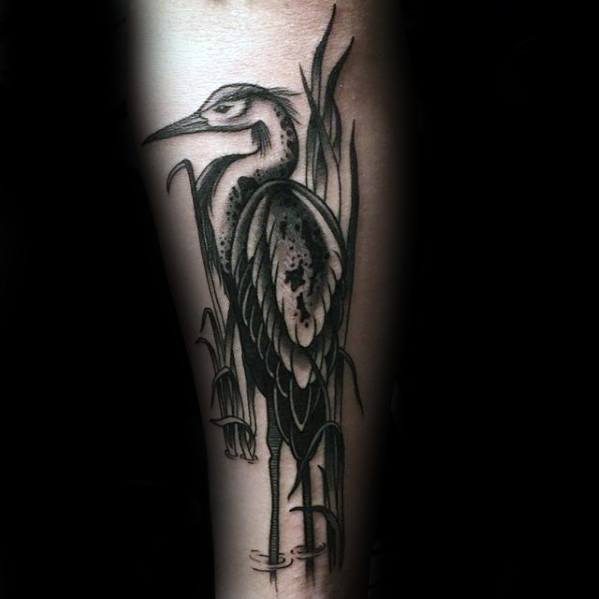
Identify the location of right plant. The width and height of the screenshot is (599, 599). (326, 149).